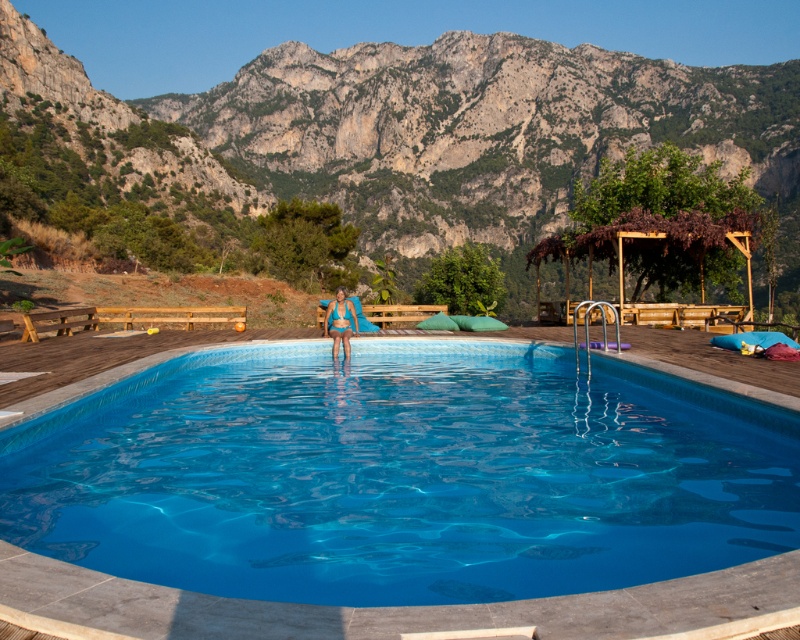
You are standing at the edge of a wooden deck and want to jump into the blue tile swimming pool at center. If your maximum comfortable jumping distance is 20 meters, can you safely jump into the pool from where you are?

The blue tile swimming pool at center is 18.90 meters away from the viewer. Since your maximum comfortable jumping distance is 20 meters, you can safely jump into the pool from your current position as the distance is within your comfort range.

You are standing at the edge of the pool and want to place a 100 feet long inflatable slide from the blue fabric at center to the rugged stone mountain at upper center. Is this possible?

The rugged stone mountain at upper center is 387.59 feet from the blue fabric at center. Since the slide is only 100 feet long, it cannot reach the rugged stone mountain at upper center.